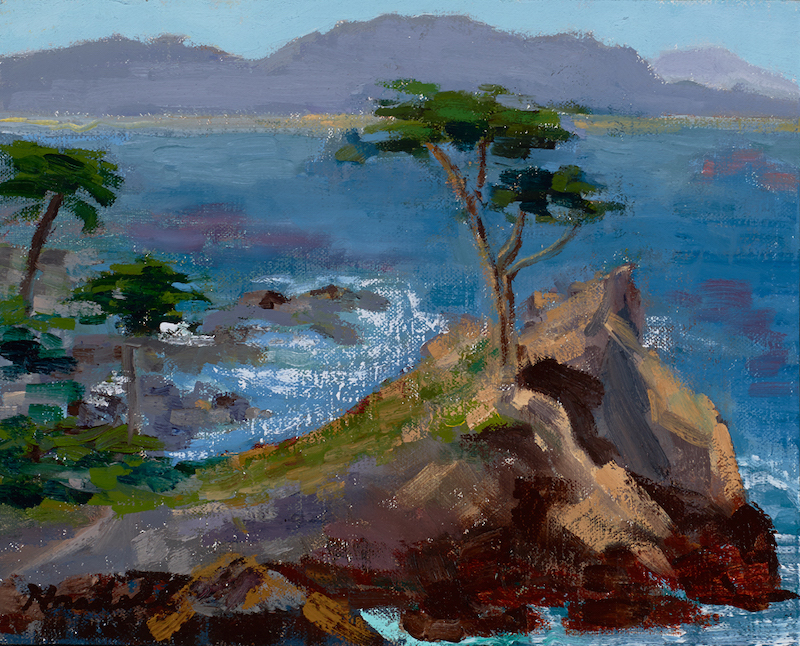
Where is `artwork`? This screenshot has height=646, width=800. artwork is located at coordinates (757, 442).